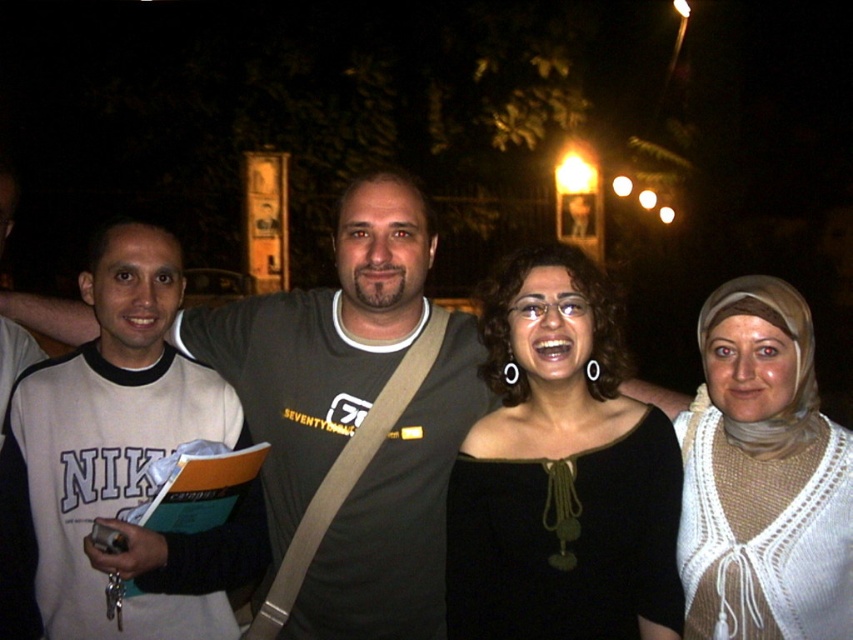
Question: Is white knitted scarf at right to the right of gray cotton shirt at center from the viewer's perspective?

Choices:
 (A) no
 (B) yes

Answer: (B)

Question: Among these objects, which one is nearest to the camera?

Choices:
 (A) gray cotton shirt at center
 (B) white knitted scarf at right
 (C) black matte top at center
 (D) white cotton shirt at left

Answer: (D)

Question: Among these objects, which one is nearest to the camera?

Choices:
 (A) black matte top at center
 (B) white knitted scarf at right
 (C) white cotton shirt at left
 (D) gray cotton shirt at center

Answer: (C)

Question: Does white cotton shirt at left have a larger size compared to gray cotton shirt at center?

Choices:
 (A) yes
 (B) no

Answer: (A)

Question: Which object is the closest to the white knitted scarf at right?

Choices:
 (A) black matte top at center
 (B) gray cotton shirt at center

Answer: (A)

Question: Is black matte top at center to the left of white cotton shirt at left from the viewer's perspective?

Choices:
 (A) no
 (B) yes

Answer: (A)